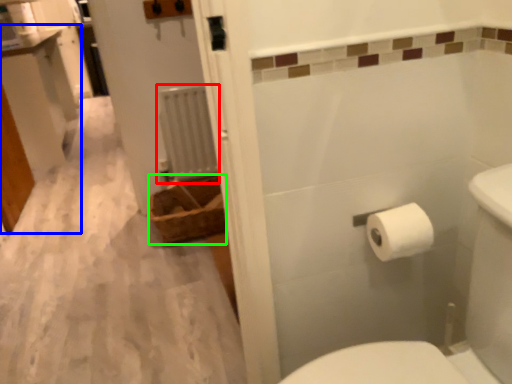
Question: Which object is positioned closest to radiator (highlighted by a red box)? Select from vanity (highlighted by a blue box) and basket (highlighted by a green box).

Choices:
 (A) vanity
 (B) basket

Answer: (B)